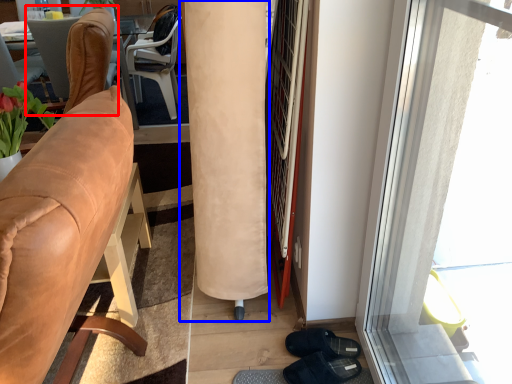
Question: Among these objects, which one is nearest to the camera, chair (highlighted by a red box) or curtain (highlighted by a blue box)?

Choices:
 (A) chair
 (B) curtain

Answer: (B)